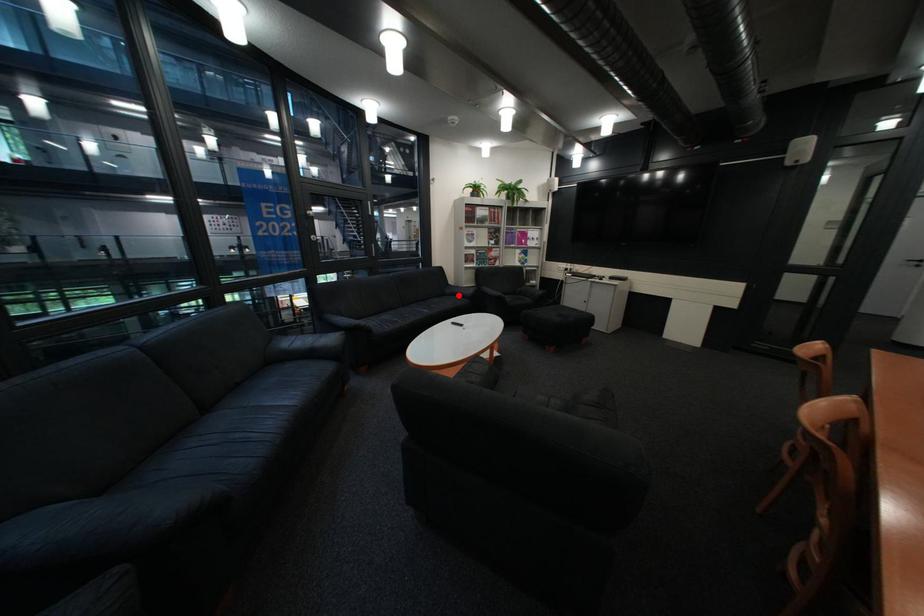
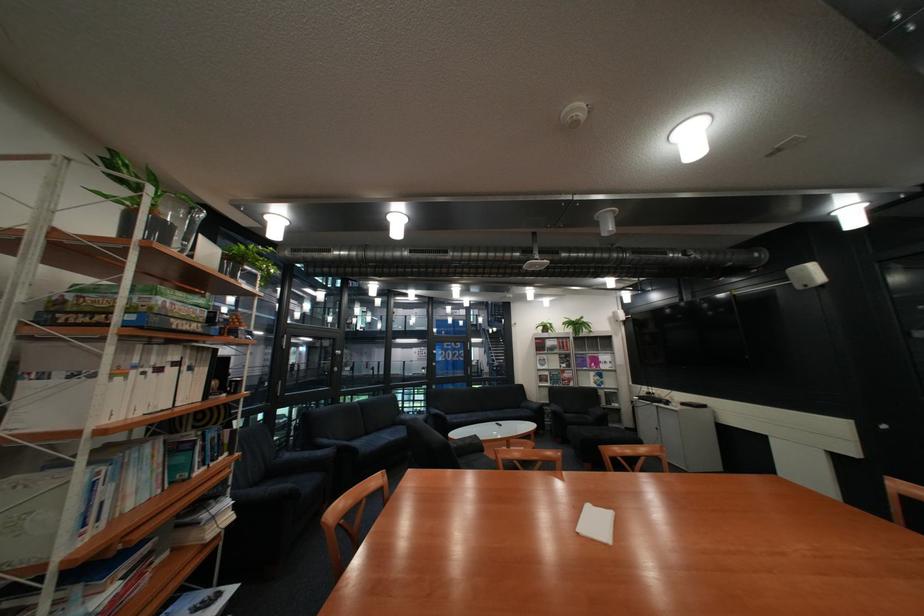
Question: I am providing you with two images of the same scene from different viewpoints. Image1 has a red point marked. In image2, the corresponding 3D location appears at what relative position? Reply with the corresponding letter.

Choices:
 (A) Closer
 (B) Farther

Answer: (B)